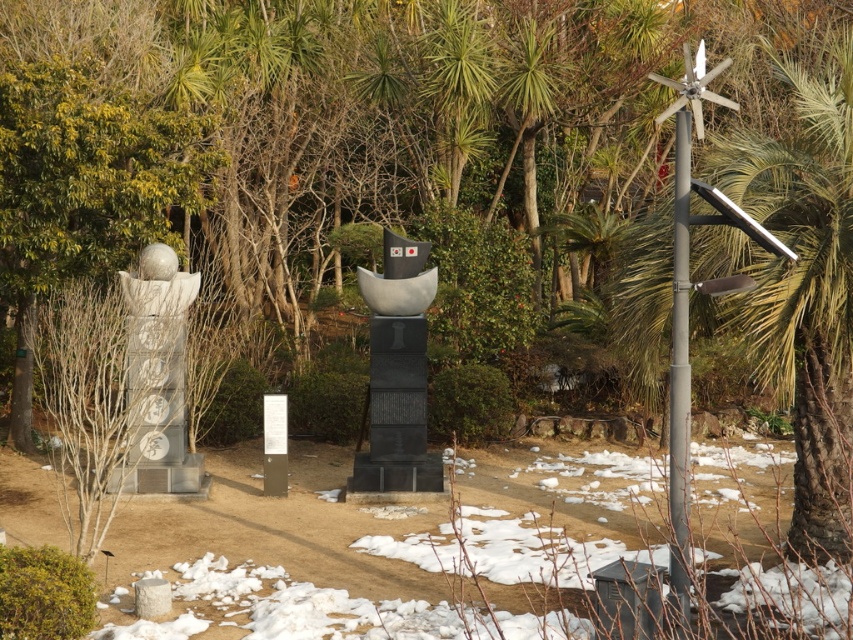
Who is taller, black polished stone monument at center or white stone statue at left?

Standing taller between the two is black polished stone monument at center.

Can you confirm if black polished stone monument at center is positioned to the right of white stone statue at left?

Correct, you'll find black polished stone monument at center to the right of white stone statue at left.

Which is in front, point (418, 337) or point (196, 282)?

Positioned in front is point (418, 337).

Locate an element on the screen. The height and width of the screenshot is (640, 853). black polished stone monument at center is located at coordinates (397, 372).

In the scene shown: Does green leafy palm tree at right have a lesser height compared to gray metallic pole at right?

Incorrect, green leafy palm tree at right's height does not fall short of gray metallic pole at right's.

Between green leafy palm tree at right and gray metallic pole at right, which one has more height?

With more height is green leafy palm tree at right.

This screenshot has width=853, height=640. I want to click on green leafy palm tree at right, so click(805, 285).

Is green leafy palm tree at right to the right of white stone statue at left from the viewer's perspective?

Yes, green leafy palm tree at right is to the right of white stone statue at left.

This screenshot has width=853, height=640. I want to click on green leafy palm tree at right, so click(805, 285).

Locate an element on the screen. The width and height of the screenshot is (853, 640). green leafy palm tree at right is located at coordinates point(805,285).